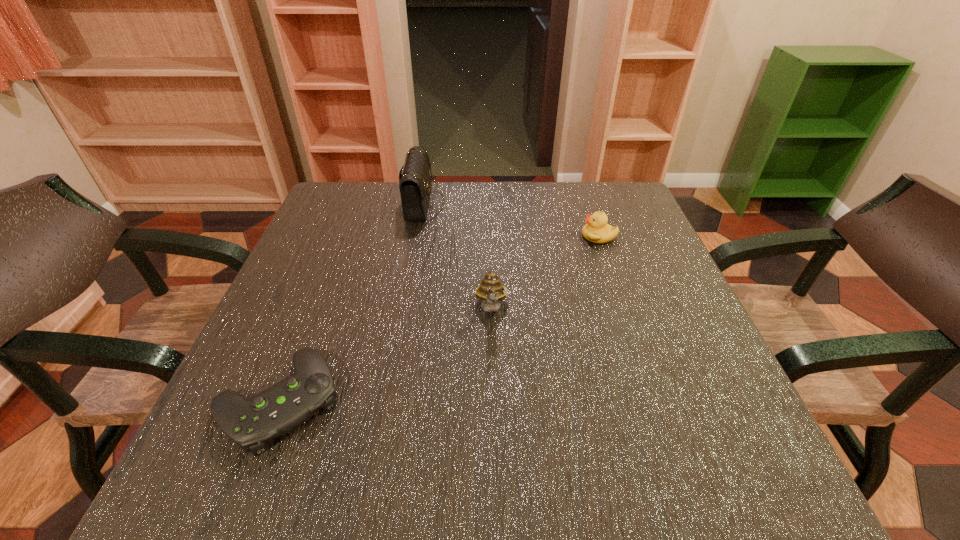
The width and height of the screenshot is (960, 540). What are the coordinates of `the farthest object` in the screenshot? It's located at (415, 184).

In order to click on clutch bag in this screenshot , I will do `click(415, 184)`.

Image resolution: width=960 pixels, height=540 pixels. What are the coordinates of `snail` in the screenshot? It's located at (490, 290).

Where is `the second nearest object`? This screenshot has height=540, width=960. the second nearest object is located at coordinates (490, 290).

Image resolution: width=960 pixels, height=540 pixels. I want to click on duckling, so click(x=596, y=230).

Where is `the second shortest object`? This screenshot has width=960, height=540. the second shortest object is located at coordinates (596, 230).

Where is `the shortest object`? the shortest object is located at coordinates (251, 423).

You are a GUI agent. You are given a task and a screenshot of the screen. Output one action in this format:
    pyautogui.click(x=<x>, y=<y>)
    Task: Click on the leftmost object
    The image size is (960, 540).
    Given the screenshot: What is the action you would take?
    pyautogui.click(x=251, y=423)

Where is `vacant space situated on the front flap of the clutch bag`? The image size is (960, 540). vacant space situated on the front flap of the clutch bag is located at coordinates (554, 202).

Locate an element on the screen. Image resolution: width=960 pixels, height=540 pixels. vacant space located on the face of the snail is located at coordinates (495, 418).